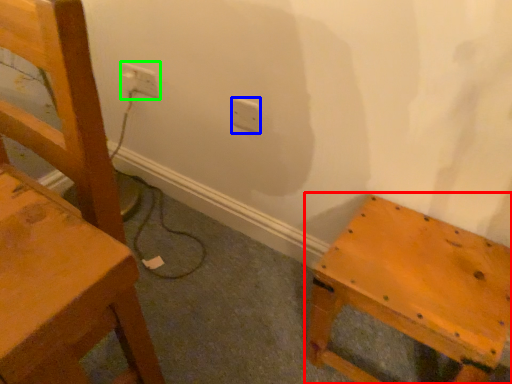
Question: Considering the real-world distances, which object is farthest from furniture (highlighted by a red box)? electric outlet (highlighted by a blue box) or electric outlet (highlighted by a green box)?

Choices:
 (A) electric outlet
 (B) electric outlet

Answer: (B)